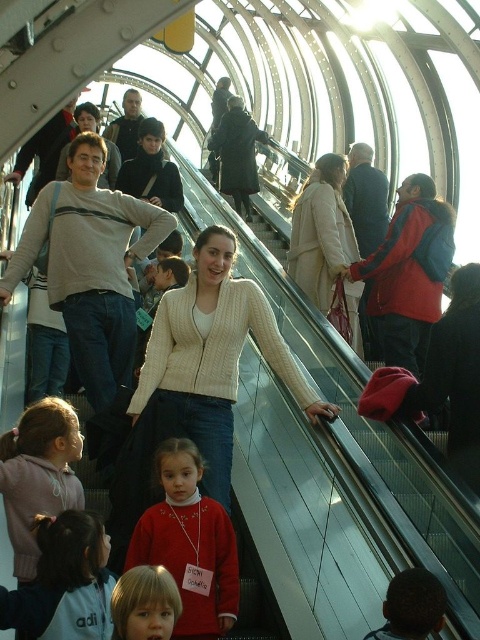
Does white knitted sweater at center appear on the left side of matte red sweater at center?

No, white knitted sweater at center is not to the left of matte red sweater at center.

Does point (180, 433) come farther from viewer compared to point (139, 531)?

Yes, it is behind point (139, 531).

Identify the location of white knitted sweater at center. Image resolution: width=480 pixels, height=640 pixels. (203, 372).

Which is below, pink fleece jacket at lower left or white knit sweater at center?

pink fleece jacket at lower left

Does pink fleece jacket at lower left have a larger size compared to white knit sweater at center?

Incorrect, pink fleece jacket at lower left is not larger than white knit sweater at center.

This screenshot has width=480, height=640. Describe the element at coordinates (38, 474) in the screenshot. I see `pink fleece jacket at lower left` at that location.

Image resolution: width=480 pixels, height=640 pixels. In order to click on pink fleece jacket at lower left in this screenshot , I will do `click(38, 474)`.

Is matte red sweater at center positioned in front of matte red sweater at lower center?

No, matte red sweater at center is behind matte red sweater at lower center.

Between matte red sweater at center and matte red sweater at lower center, which one appears on the left side from the viewer's perspective?

From the viewer's perspective, matte red sweater at lower center appears more on the left side.

Which is behind, point (147, 528) or point (171, 596)?

The point (147, 528) is behind.

This screenshot has height=640, width=480. Identify the location of matte red sweater at center. (190, 545).